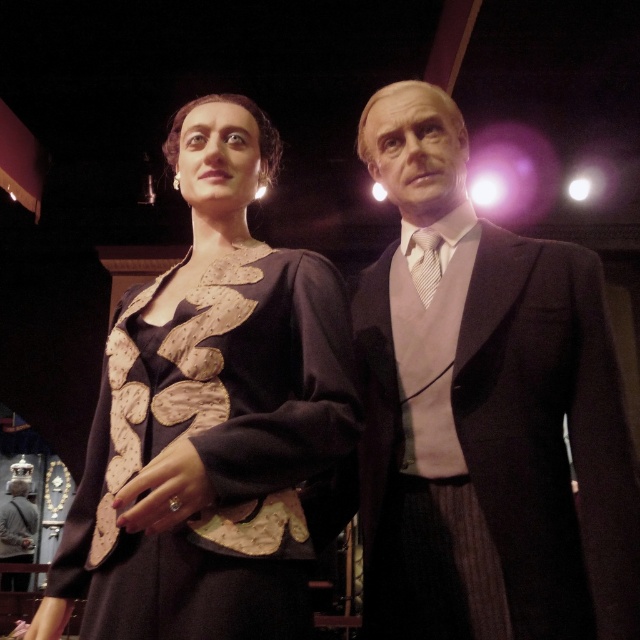
Is the position of matte black suit at right less distant than that of matte black dress at center?

No, it is not.

Does point (547, 451) come closer to viewer compared to point (268, 292)?

No, it is behind (268, 292).

This screenshot has width=640, height=640. I want to click on matte black suit at right, so click(x=484, y=410).